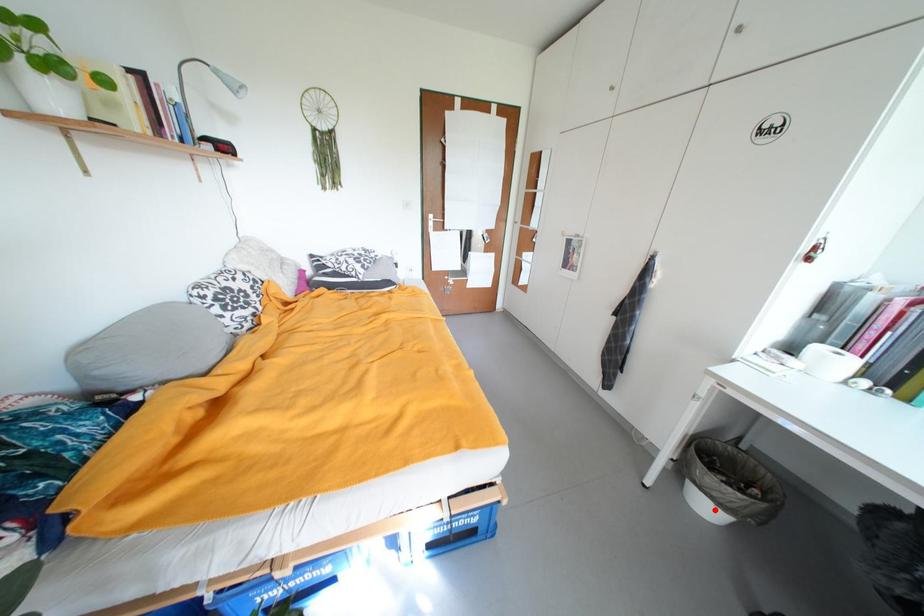
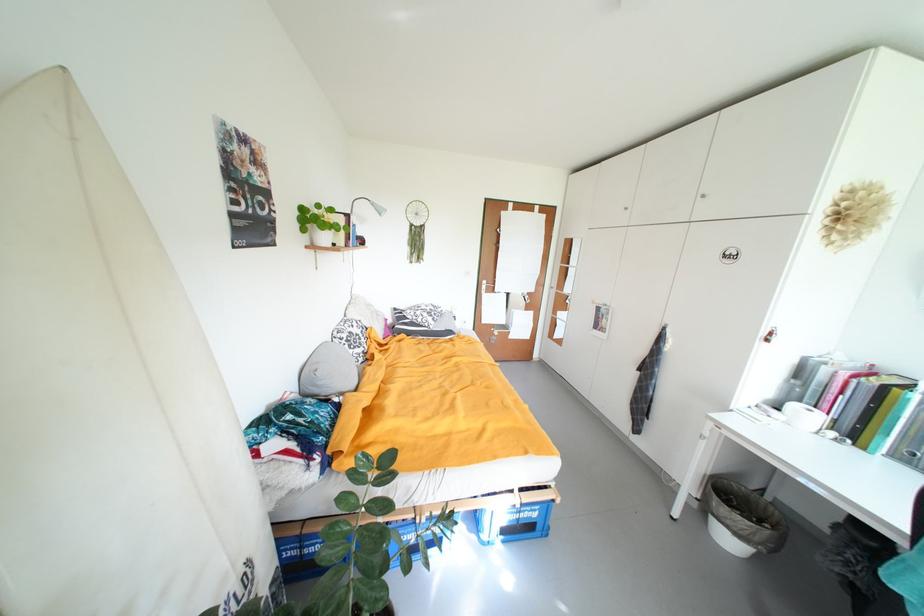
Where in the second image is the point corresponding to the highlighted location from the first image?

(736, 544)